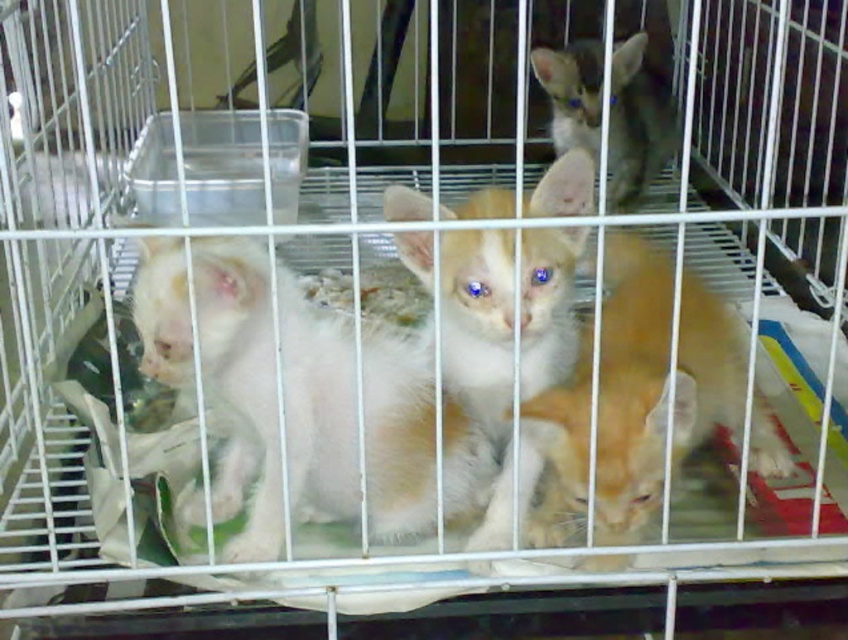
Question: Which is nearer to the transparent plastic container at center?

Choices:
 (A) fluffy white kitten at center
 (B) gray fur cat at upper center

Answer: (B)

Question: Can you confirm if white fluffy cat at center is bigger than gray fur cat at upper center?

Choices:
 (A) yes
 (B) no

Answer: (B)

Question: Does white fluffy cat at center have a lesser width compared to orange fur cat at center?

Choices:
 (A) yes
 (B) no

Answer: (B)

Question: Which object is the farthest from the transparent plastic container at center?

Choices:
 (A) gray fur cat at upper center
 (B) white fluffy cat at center
 (C) orange fur cat at center
 (D) fluffy white kitten at center

Answer: (C)

Question: Can you confirm if white fluffy cat at center is positioned below gray fur cat at upper center?

Choices:
 (A) yes
 (B) no

Answer: (A)

Question: Which object appears farthest from the camera in this image?

Choices:
 (A) fluffy white kitten at center
 (B) white fluffy cat at center
 (C) gray fur cat at upper center
 (D) transparent plastic container at center

Answer: (C)